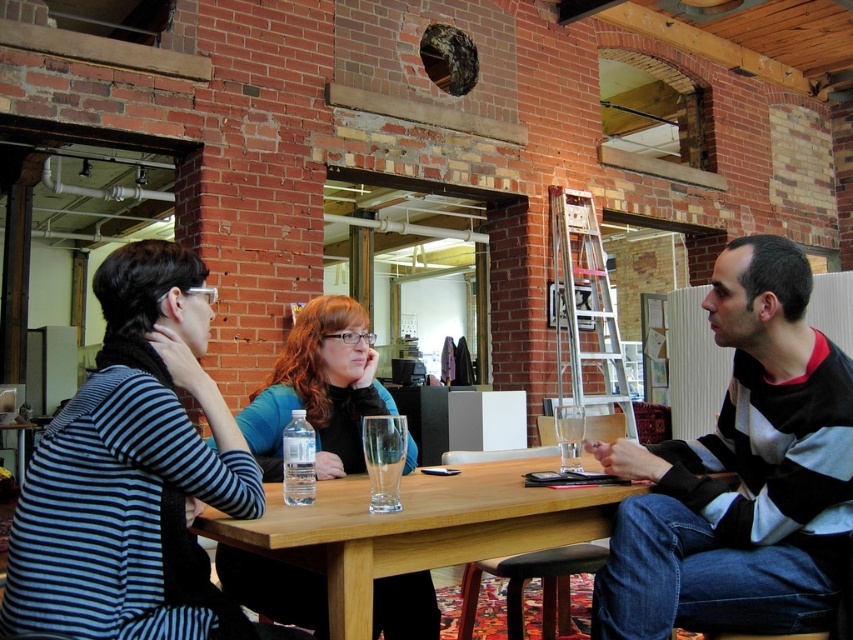
Is striped sweater at center to the left of transparent glass at table center from the viewer's perspective?

In fact, striped sweater at center is to the right of transparent glass at table center.

What do you see at coordinates (741, 474) in the screenshot? The height and width of the screenshot is (640, 853). I see `striped sweater at center` at bounding box center [741, 474].

This screenshot has width=853, height=640. I want to click on striped sweater at center, so click(741, 474).

Between striped fabric shirt at left and wooden table at center, which one is positioned higher?

striped fabric shirt at left

How far apart are striped fabric shirt at left and wooden table at center?

striped fabric shirt at left and wooden table at center are 13.55 inches apart from each other.

Identify the location of striped fabric shirt at left. click(x=132, y=472).

Which is in front, point (734, 465) or point (170, 529)?

Point (170, 529)

Is striped sweater at center bigger than striped fabric shirt at left?

Yes.

Locate an element on the screen. This screenshot has width=853, height=640. striped sweater at center is located at coordinates (741, 474).